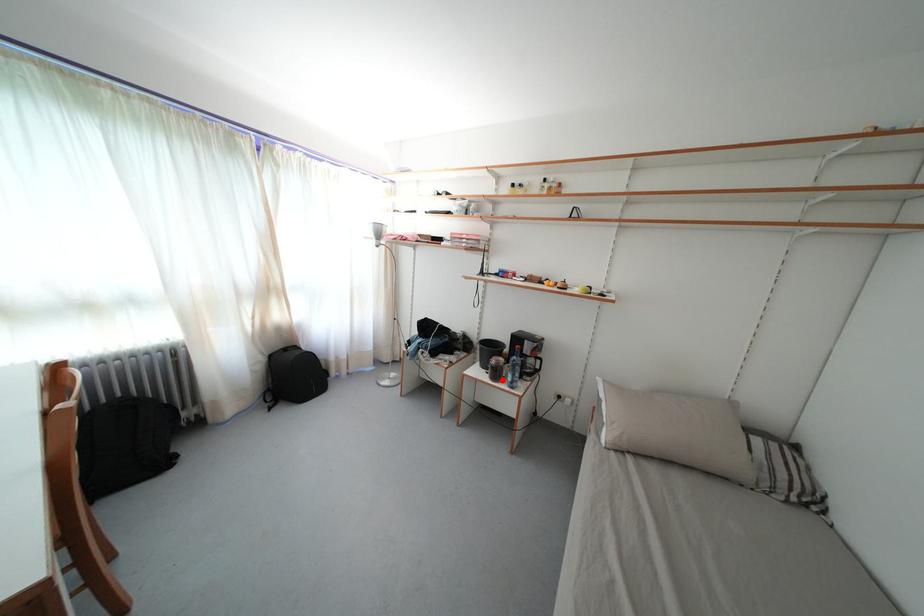
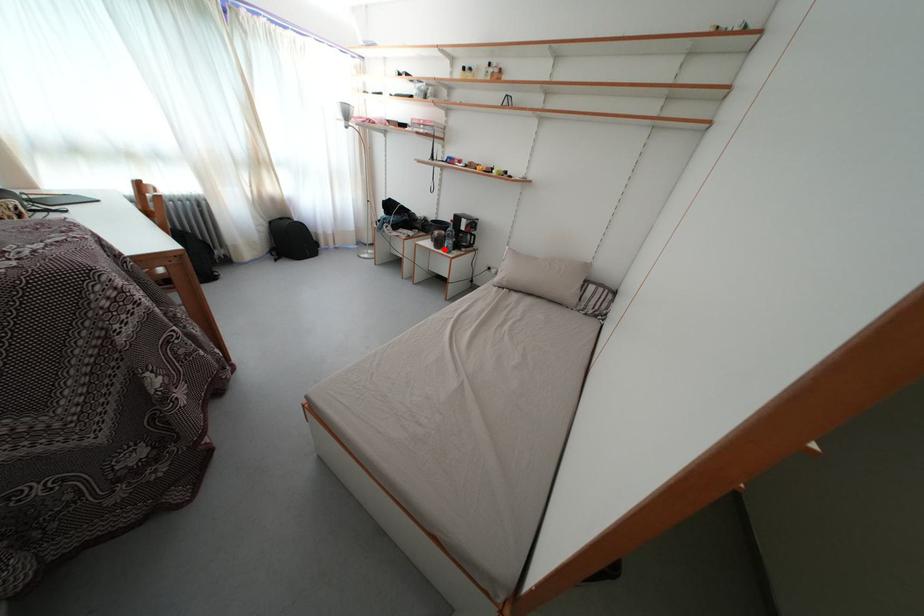
I am providing you with two images of the same scene from different viewpoints. A red point is marked on the first image and another point is marked on the second image. Do the highlighted points in image1 and image2 indicate the same real-world spot?

Yes